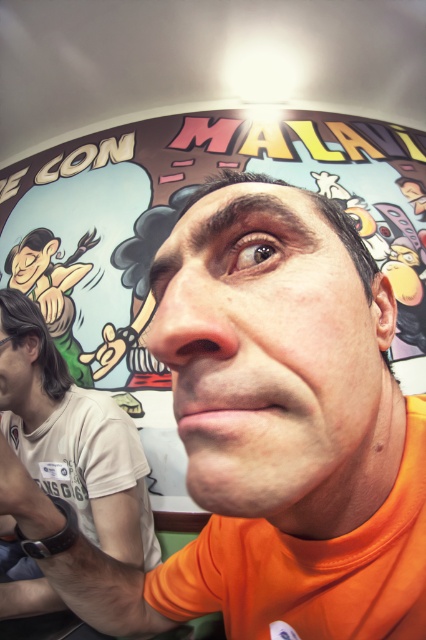
In the scene shown: Between orange matte shirt at center and matte green face at upper left, which one is positioned lower?

orange matte shirt at center is below.

The width and height of the screenshot is (426, 640). What do you see at coordinates (276, 445) in the screenshot? I see `orange matte shirt at center` at bounding box center [276, 445].

Identify the location of orange matte shirt at center. tap(276, 445).

Can you confirm if pink matte lips at center is bigger than matte black hair at left?

No, pink matte lips at center is not bigger than matte black hair at left.

Does pink matte lips at center have a lesser width compared to matte black hair at left?

Correct, pink matte lips at center's width is less than matte black hair at left's.

What do you see at coordinates (224, 413) in the screenshot? Image resolution: width=426 pixels, height=640 pixels. I see `pink matte lips at center` at bounding box center [224, 413].

Find the location of a particular element. This screenshot has width=426, height=640. pink matte lips at center is located at coordinates (224, 413).

Is point (176, 417) farther from camera compared to point (46, 260)?

No.

Is pink matte lips at center positioned in front of matte green face at upper left?

Yes, pink matte lips at center is closer to the viewer.

Does point (239, 403) come closer to viewer compared to point (46, 259)?

Yes, point (239, 403) is in front of point (46, 259).

Locate an element on the screen. This screenshot has width=426, height=640. pink matte lips at center is located at coordinates (224, 413).